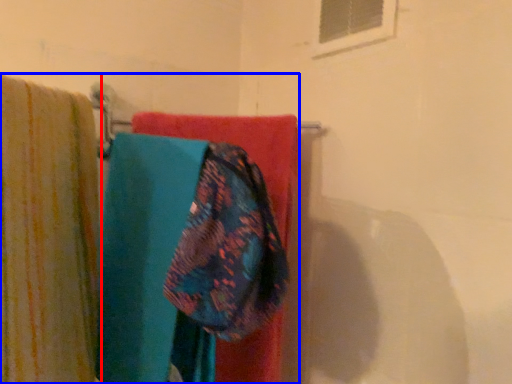
Question: Which of the following is the farthest to the observer, curtain (highlighted by a red box) or laundry (highlighted by a blue box)?

Choices:
 (A) curtain
 (B) laundry

Answer: (B)